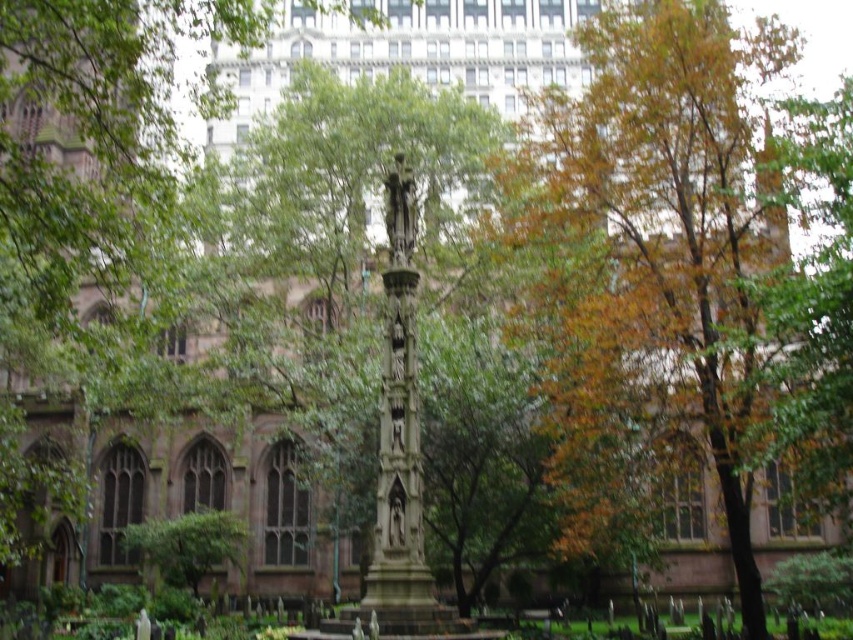
In the scene shown: You are an artist sketching the scene and need to decide which area to focus on first. Since you want to capture the most visually striking elements, which object in the image has a greater width, the autumn leaves at center or the green leafy tree at lower left?

The autumn leaves at center has a greater width than the green leafy tree at lower left according to the description.

Looking at this image, you are standing in the historic churchyard and notice the autumn leaves at center and the green leafy tree at lower left. Which object is positioned higher in the scene?

The autumn leaves at center are positioned higher than the green leafy tree at lower left.

You are standing in the historic churchyard and notice the autumn leaves at center and the green leafy tree at lower left. Which object is taller?

The autumn leaves at center is much taller than the green leafy tree at lower left according to the description.